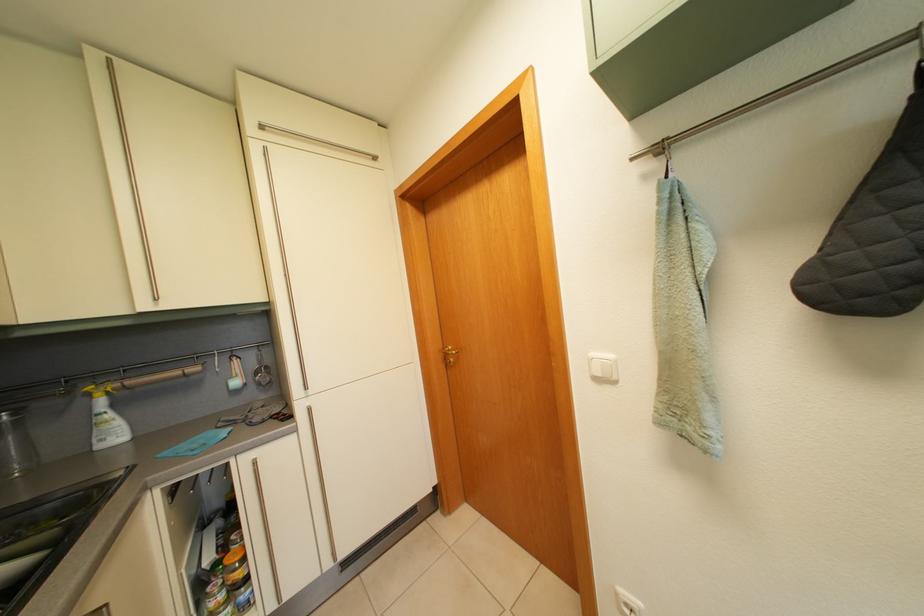
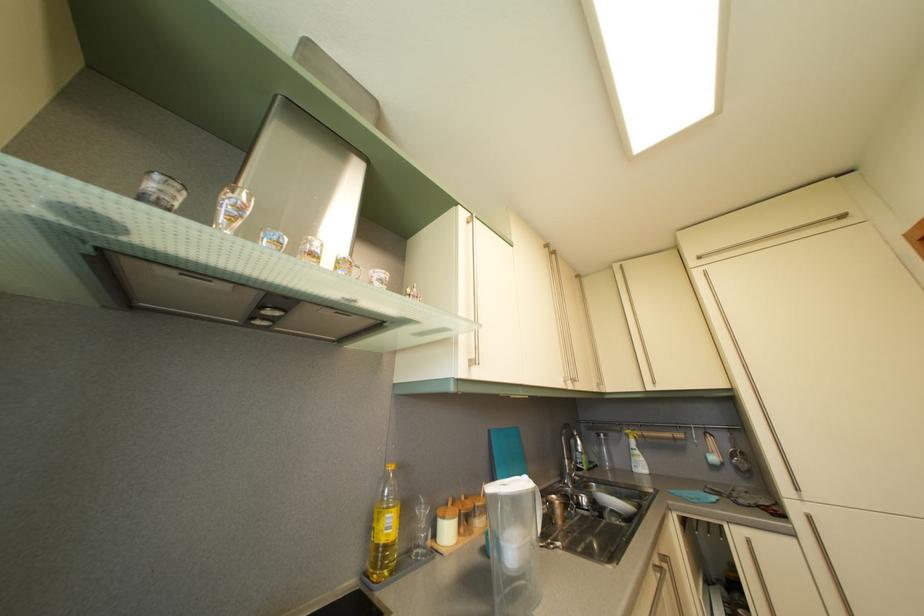
In the second image, find the point that corresponds to (268,392) in the first image.

(746, 476)